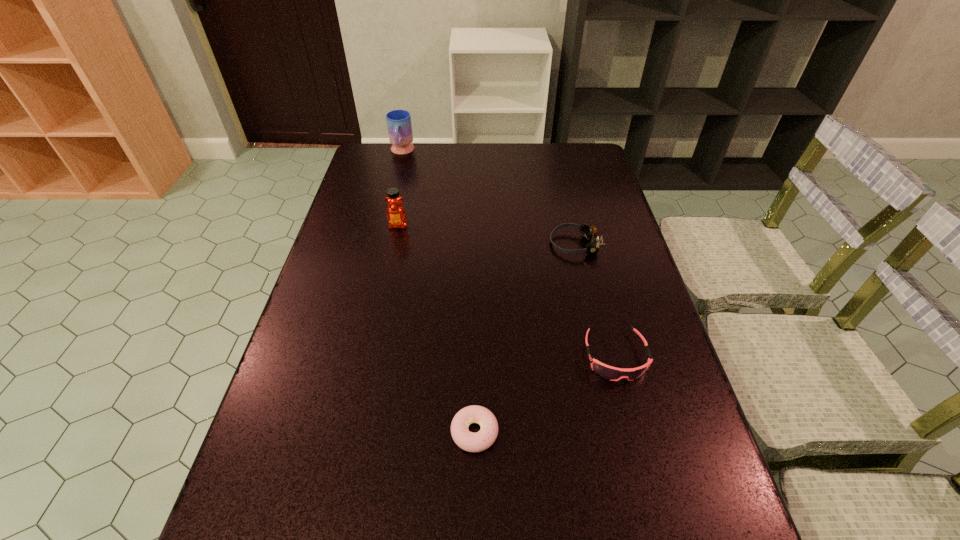
This screenshot has height=540, width=960. I want to click on mug, so click(399, 125).

Where is `honey`? honey is located at coordinates (396, 215).

Locate an element on the screen. The height and width of the screenshot is (540, 960). the farther goggles is located at coordinates (589, 231).

The image size is (960, 540). What are the coordinates of `the second nearest object` in the screenshot? It's located at (608, 372).

Image resolution: width=960 pixels, height=540 pixels. In order to click on the third object from left to right in this screenshot , I will do `click(472, 442)`.

This screenshot has height=540, width=960. Find the location of `the nearest object`. the nearest object is located at coordinates (472, 442).

Identify the location of vacant space situated 0.090m on the side of the farthest object with the handle. (396, 174).

Image resolution: width=960 pixels, height=540 pixels. Identify the location of vacant space located 0.080m on the front label of the honey. (394, 248).

You are a GUI agent. You are given a task and a screenshot of the screen. Output one action in this format:
    pyautogui.click(x=<x>, y=<y>)
    Task: Click on the vacant area situated through the lenses of the farther goggles
    
    Given the screenshot: What is the action you would take?
    pyautogui.click(x=486, y=244)

At what (x,y) coordinates should I click in order to perform the action: click on blank space located through the lenses of the farther goggles. Please return your answer as a coordinate pair (x, y). The height and width of the screenshot is (540, 960). Looking at the image, I should click on (510, 244).